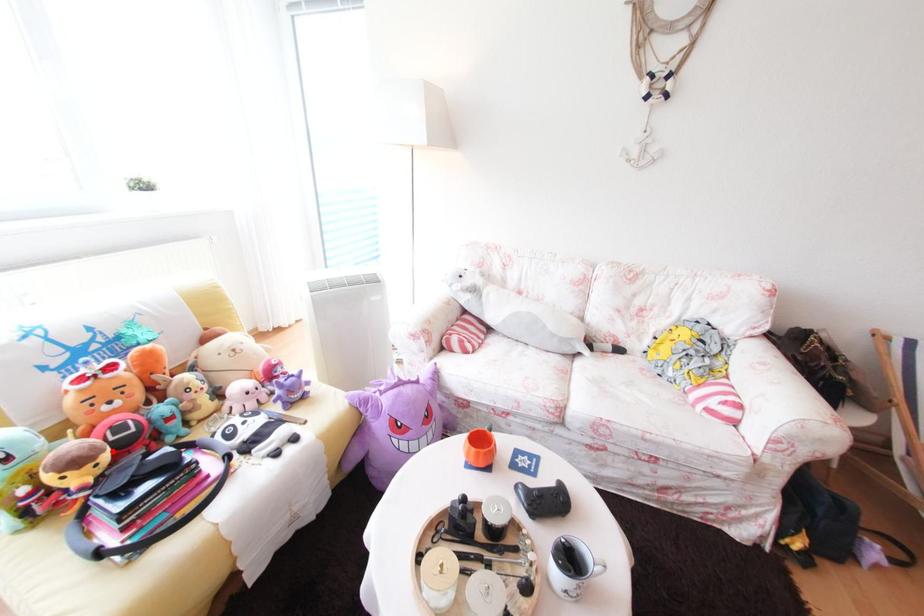
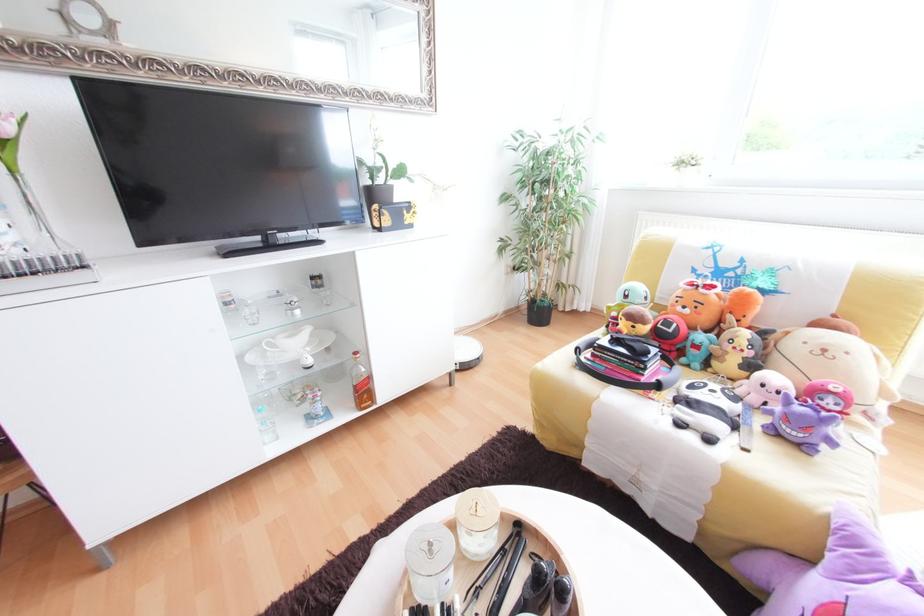
Find the pixel in the second image that matches the highlighted location in the first image.

(652, 323)